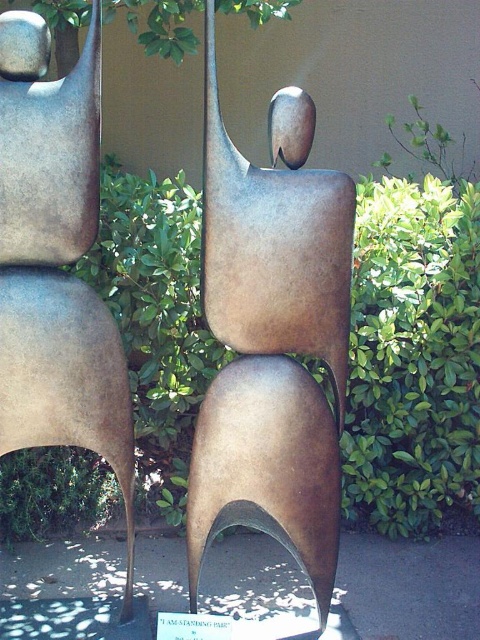
You are standing in front of two sculptures in the center of the image. The bronze sculpture at center and the matte bronze figure at center. Which one is positioned to the right?

The bronze sculpture at center is positioned to the right of the matte bronze figure at center.

You are an art student trying to sketch the two sculptures in the image. You notice that the bronze sculpture at center and the matte bronze figure at center are both in the center. Which one do you think is wider?

The bronze sculpture at center is wider than the matte bronze figure at center.